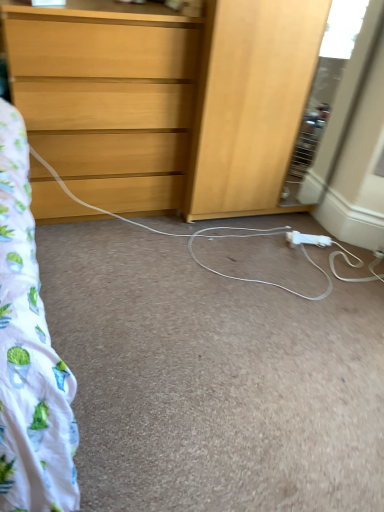
Find the location of a particular element. free space on the front side of light wood chest of drawers at upper left is located at coordinates (112, 265).